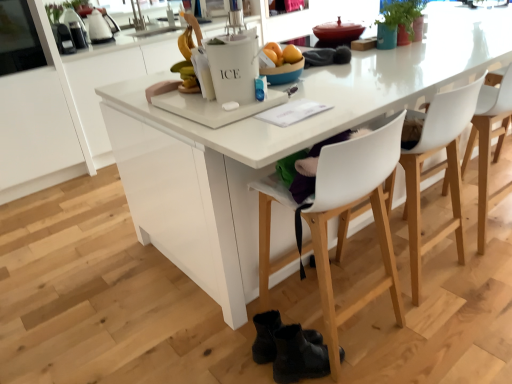
Question: Which direction should I rotate to look at black leather boots at lower center, acting as the first footwear starting from the back, — up or down?

Choices:
 (A) down
 (B) up

Answer: (A)

Question: Can you confirm if white plastic chair at center, the 2th chair viewed from the left, is taller than white plastic chair at center, which is the 1th chair in left-to-right order?

Choices:
 (A) no
 (B) yes

Answer: (B)

Question: From the image's perspective, is white plastic chair at center, which is counted as the second chair, starting from the right, below white plastic chair at center, which is the 1th chair in left-to-right order?

Choices:
 (A) yes
 (B) no

Answer: (B)

Question: Can you confirm if white plastic chair at center, the 2th chair viewed from the left, is shorter than white plastic chair at center, which is counted as the 3th chair, starting from the right?

Choices:
 (A) yes
 (B) no

Answer: (B)

Question: From the image's perspective, does white plastic chair at center, which is counted as the second chair, starting from the right, appear higher than white plastic chair at center, which is counted as the 3th chair, starting from the right?

Choices:
 (A) yes
 (B) no

Answer: (A)

Question: Is white plastic chair at center, which is counted as the second chair, starting from the right, next to white plastic chair at center, which is the 1th chair in left-to-right order, and touching it?

Choices:
 (A) no
 (B) yes

Answer: (A)

Question: Are white plastic chair at center, the 2th chair viewed from the left, and white plastic chair at center, which is the 1th chair in left-to-right order, located far from each other?

Choices:
 (A) no
 (B) yes

Answer: (A)

Question: From the image's perspective, is white plastic chair at right, which is the first chair from right to left, above transparent glass window at upper left?

Choices:
 (A) yes
 (B) no

Answer: (B)

Question: Could you tell me if white plastic chair at right, acting as the third chair starting from the left, is facing transparent glass window at upper left?

Choices:
 (A) yes
 (B) no

Answer: (B)

Question: Is white plastic chair at right, acting as the third chair starting from the left, thinner than transparent glass window at upper left?

Choices:
 (A) no
 (B) yes

Answer: (B)

Question: Is white plastic chair at right, acting as the third chair starting from the left, further to the viewer compared to transparent glass window at upper left?

Choices:
 (A) no
 (B) yes

Answer: (A)

Question: Is transparent glass window at upper left inside white plastic chair at right, acting as the third chair starting from the left?

Choices:
 (A) yes
 (B) no

Answer: (B)

Question: Is white plastic chair at right, acting as the third chair starting from the left, wider than transparent glass window at upper left?

Choices:
 (A) yes
 (B) no

Answer: (B)

Question: Is black leather boots at lower center, marked as the 2th footwear in a back-to-front arrangement, closer to camera compared to green matte plant at upper right?

Choices:
 (A) yes
 (B) no

Answer: (A)